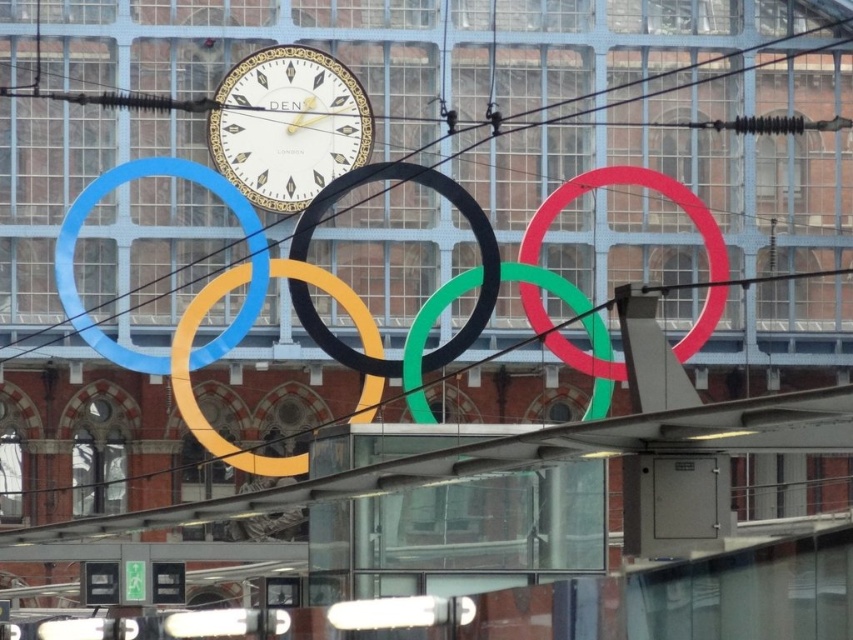
Who is positioned more to the left, blue rubber ring at center or matte yellow ring at center?

Positioned to the left is blue rubber ring at center.

The image size is (853, 640). Describe the element at coordinates (212, 193) in the screenshot. I see `blue rubber ring at center` at that location.

This screenshot has width=853, height=640. I want to click on blue rubber ring at center, so click(212, 193).

Does black rubber circle at center have a lesser width compared to matte yellow ring at center?

Incorrect, black rubber circle at center's width is not less than matte yellow ring at center's.

Is black rubber circle at center closer to the viewer compared to matte yellow ring at center?

No, black rubber circle at center is behind matte yellow ring at center.

Is point (360, 365) in front of point (364, 324)?

Yes, it is in front of point (364, 324).

The width and height of the screenshot is (853, 640). I want to click on black rubber circle at center, so click(451, 204).

Is matte gold clock at center below green matte olympic ring at center?

No.

Is matte gold clock at center closer to the viewer compared to green matte olympic ring at center?

That is False.

Who is more forward, (289, 125) or (467, 284)?

Point (467, 284) is in front.

Where is `matte gold clock at center`? The image size is (853, 640). matte gold clock at center is located at coordinates (288, 125).